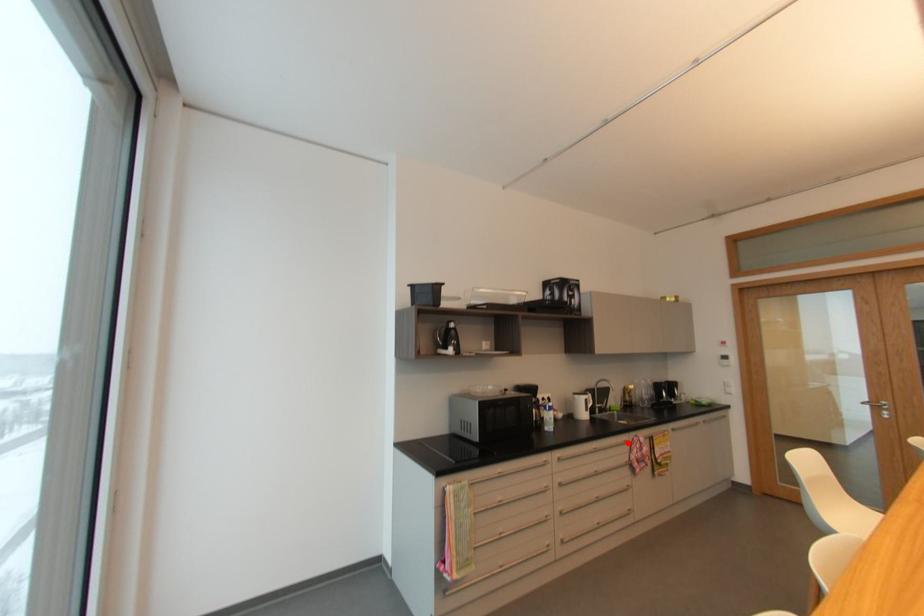
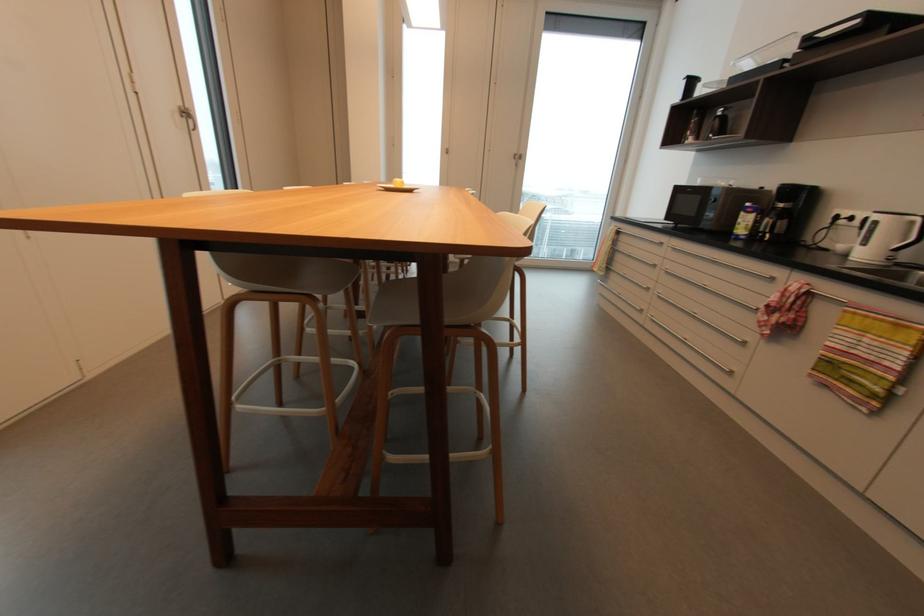
Locate, in the second image, the point that corresponds to the highlighted location in the first image.

(775, 280)